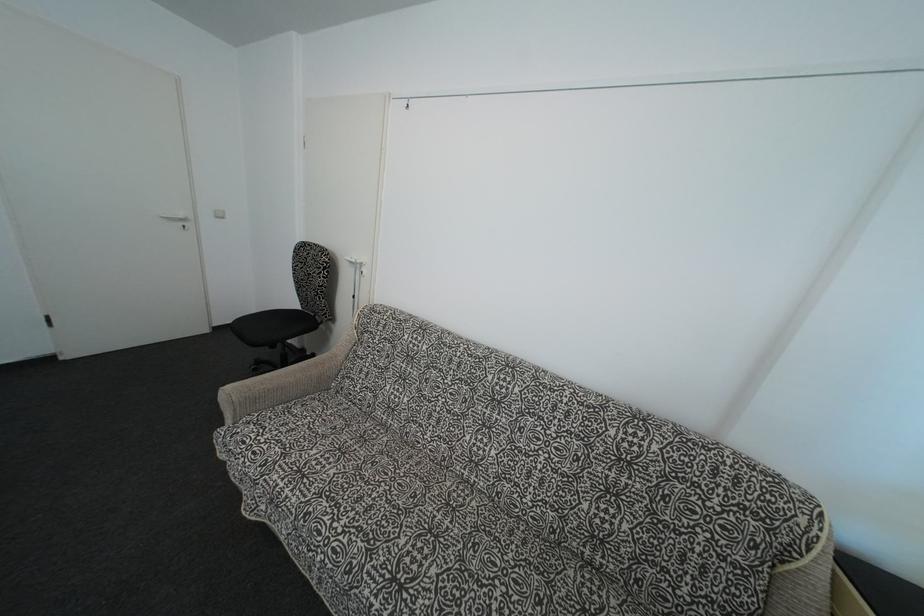
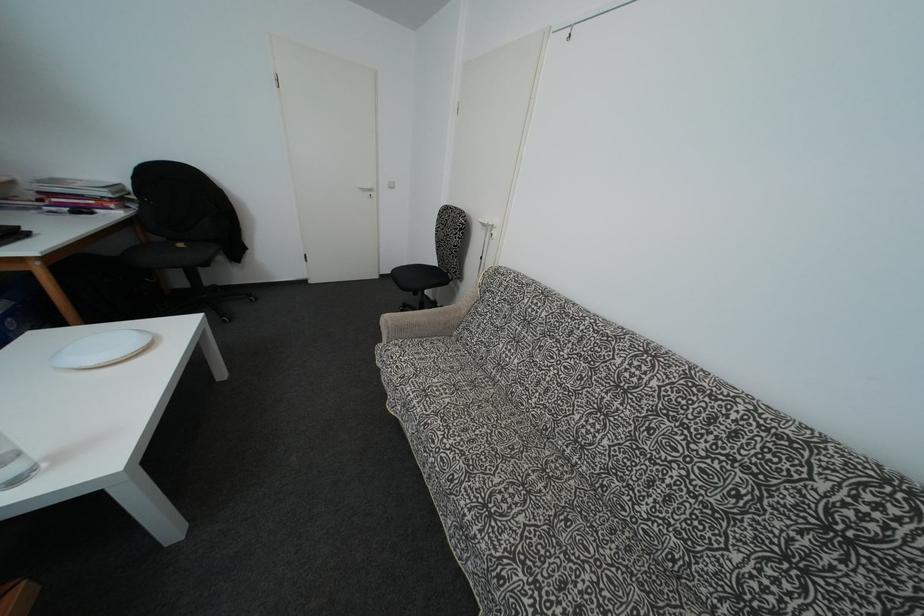
What movement of the cameraman would produce the second image?

The cameraman moved toward left, forward.